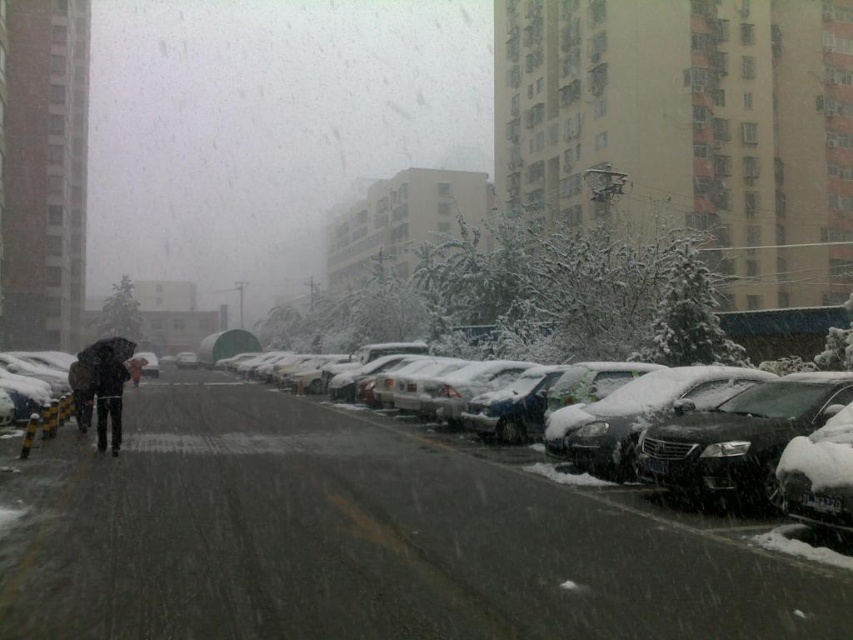
Question: Which object is the farthest from the snow-covered car at center?

Choices:
 (A) black matte umbrella at left
 (B) dark gray fabric coat at center
 (C) dark gray fabric umbrella at left

Answer: (A)

Question: Does dark gray fabric coat at center come behind snow-covered sedan at center?

Choices:
 (A) no
 (B) yes

Answer: (A)

Question: Which point appears closest to the camera in this image?

Choices:
 (A) (729, 492)
 (B) (120, 440)
 (C) (135, 346)

Answer: (A)

Question: Is dark gray fabric coat at center below snow-covered sedan at center?

Choices:
 (A) no
 (B) yes

Answer: (A)

Question: Which of these objects is positioned farthest from the snow-covered sedan at center?

Choices:
 (A) black matte umbrella at left
 (B) dark gray fabric umbrella at left

Answer: (B)

Question: Is black matte umbrella at left below snow-covered sedan at center?

Choices:
 (A) no
 (B) yes

Answer: (A)